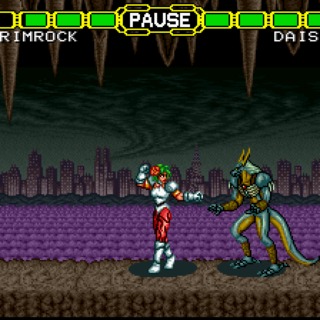
This screenshot has width=320, height=320. I want to click on floor, so click(x=92, y=269).